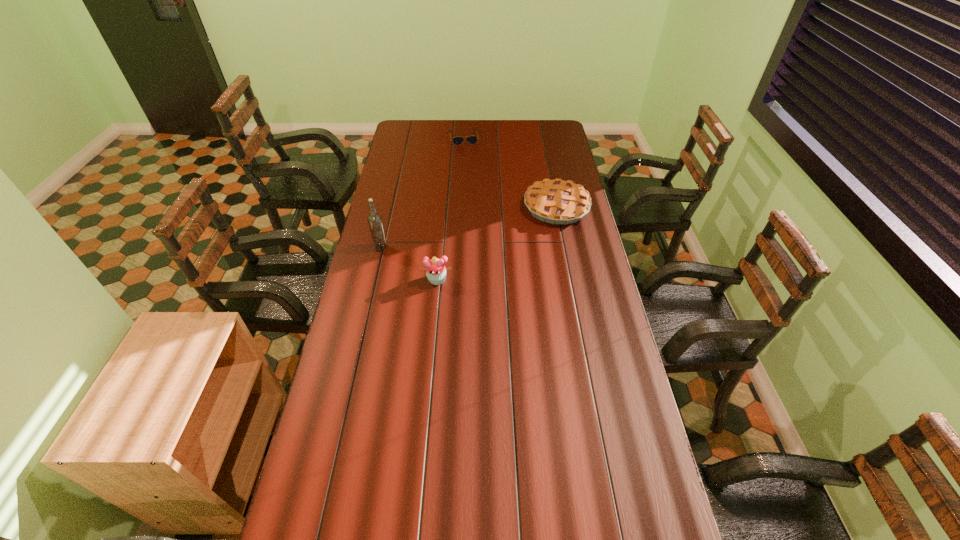
In order to click on the nearest object in this screenshot , I will do `click(436, 273)`.

At what (x,y) coordinates should I click in order to perform the action: click on cupcake. Please return your answer as a coordinate pair (x, y). Looking at the image, I should click on (436, 273).

The height and width of the screenshot is (540, 960). In order to click on the second farthest object in this screenshot , I will do `click(556, 201)`.

Where is `the rightmost object`? This screenshot has height=540, width=960. the rightmost object is located at coordinates (556, 201).

You are a GUI agent. You are given a task and a screenshot of the screen. Output one action in this format:
    pyautogui.click(x=<x>, y=<y>)
    Task: Click on the second nearest object
    This screenshot has width=960, height=540.
    Given the screenshot: What is the action you would take?
    374,219

Find the location of a particular element. vodka is located at coordinates (374, 219).

I want to click on the shortest object, so click(472, 140).

Identify the location of sunglasses. [472, 140].

Where is `vacant area situated on the face of the nearest object`? The image size is (960, 540). vacant area situated on the face of the nearest object is located at coordinates (435, 304).

I want to click on free space located on the front of the pie, so click(572, 284).